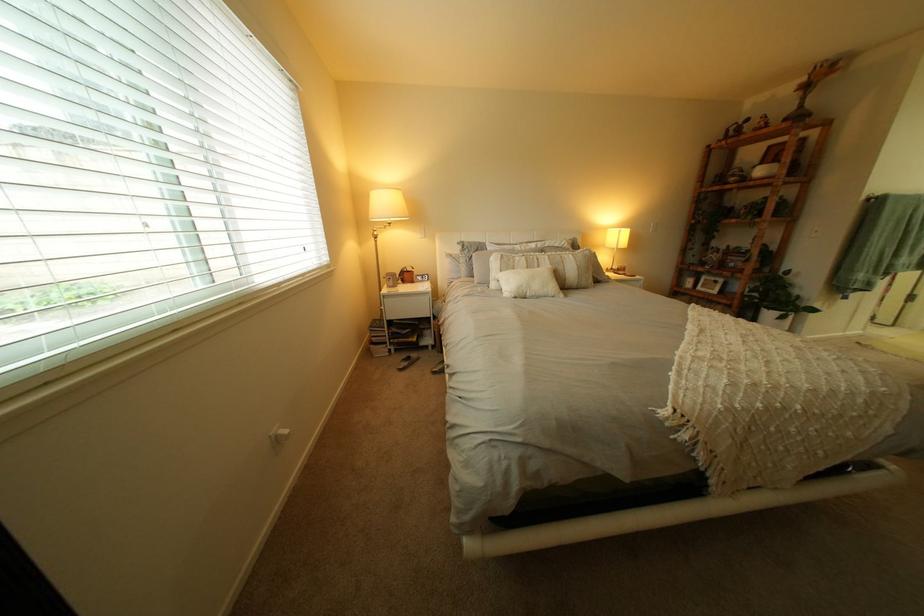
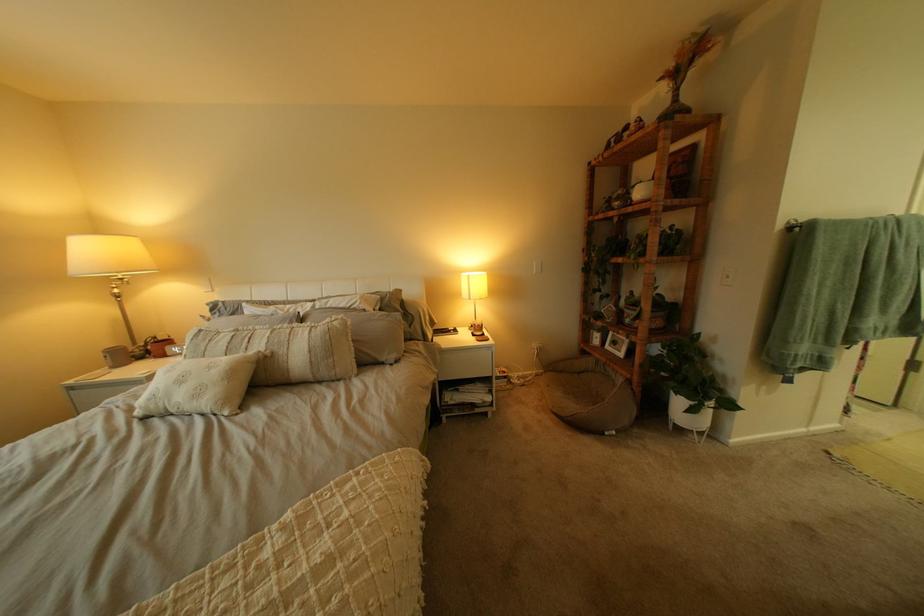
Where in the second image is the point corresponding to the point at 636,232 from the first image?

(483, 277)